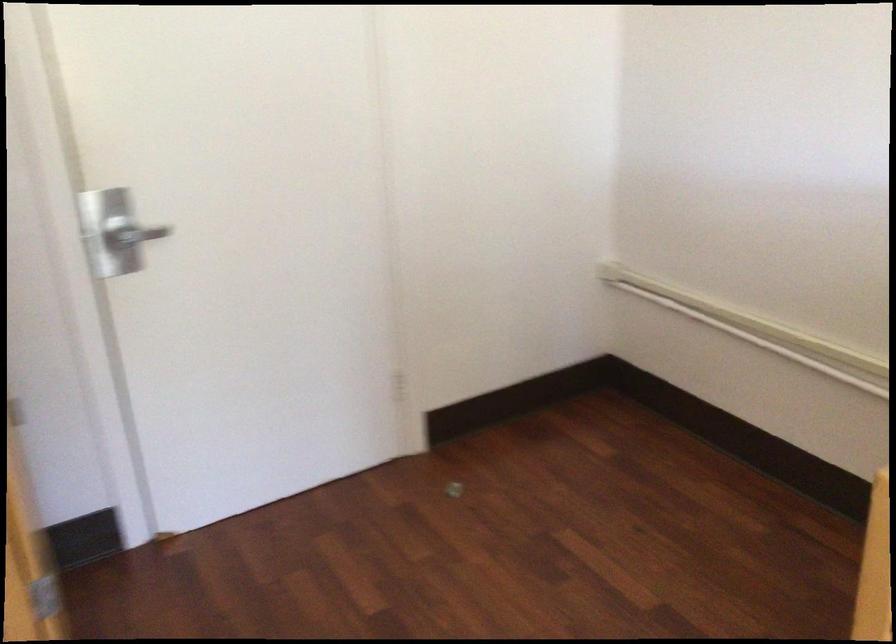
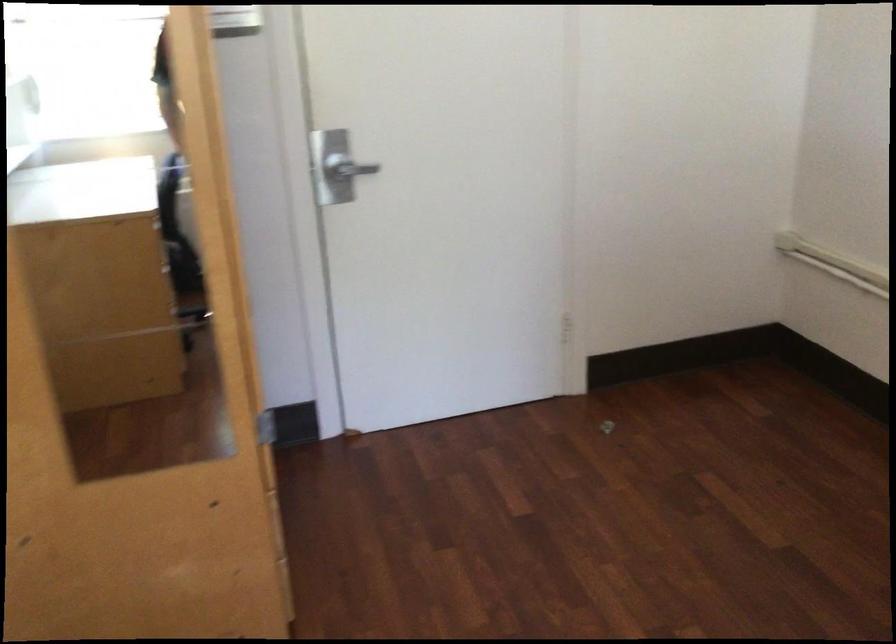
In the second image, find the point that corresponds to pixel 139 242 in the first image.

(350, 174)